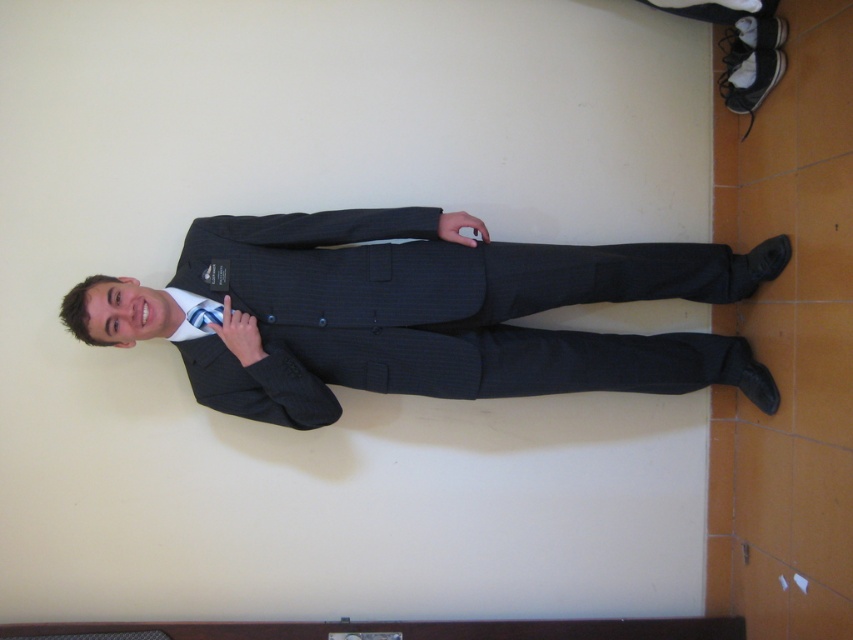
Question: Is pinstriped fabric business suit at center thinner than silky blue tie at center?

Choices:
 (A) yes
 (B) no

Answer: (B)

Question: Which of the following is the farthest from the observer?

Choices:
 (A) pos(213,316)
 (B) pos(483,339)

Answer: (B)

Question: Does pinstriped fabric business suit at center have a lesser width compared to silky blue tie at center?

Choices:
 (A) yes
 (B) no

Answer: (B)

Question: Which point appears farthest from the camera in this image?

Choices:
 (A) (207, 317)
 (B) (299, 401)

Answer: (A)

Question: Is the position of pinstriped fabric business suit at center more distant than that of silky blue tie at center?

Choices:
 (A) yes
 (B) no

Answer: (B)